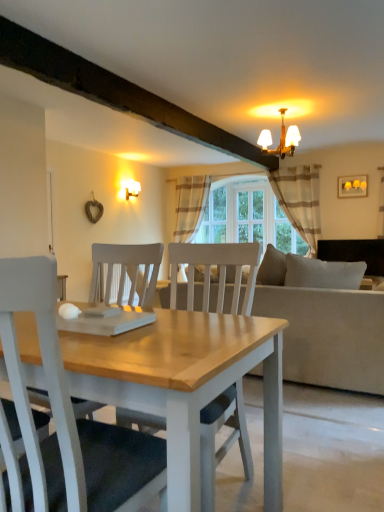
Question: Which is correct: brown striped curtain at center, which is counted as the first curtain, starting from the back, is inside matte white wall sconce at upper left, which is the 1th lamp from back to front, or outside of it?

Choices:
 (A) outside
 (B) inside

Answer: (A)

Question: Relative to matte white wall sconce at upper left, positioned as the 2th lamp in right-to-left order, is brown striped curtain at center, which is counted as the first curtain, starting from the back, in front or behind?

Choices:
 (A) behind
 (B) front

Answer: (A)

Question: Estimate the real-world distances between objects in this image. Which object is farther from the clear glass door at center?

Choices:
 (A) white glass chandelier at upper center, which is the 2th lamp in back-to-front order
 (B) brown striped curtain at center, the second curtain positioned from the right
 (C) beige striped fabric curtain at upper right, the second curtain in the left-to-right sequence
 (D) matte white wall sconce at upper left, which is counted as the first lamp, starting from the left
 (E) matte yellow picture frame at upper right

Answer: (A)

Question: Which object is the farthest from the beige fabric couch at center?

Choices:
 (A) matte yellow picture frame at upper right
 (B) matte white wall sconce at upper left, which is the 1th lamp from back to front
 (C) clear glass door at center
 (D) beige striped fabric curtain at upper right, marked as the 1th curtain in a front-to-back arrangement
 (E) white glass chandelier at upper center, which is the 2th lamp in back-to-front order

Answer: (A)